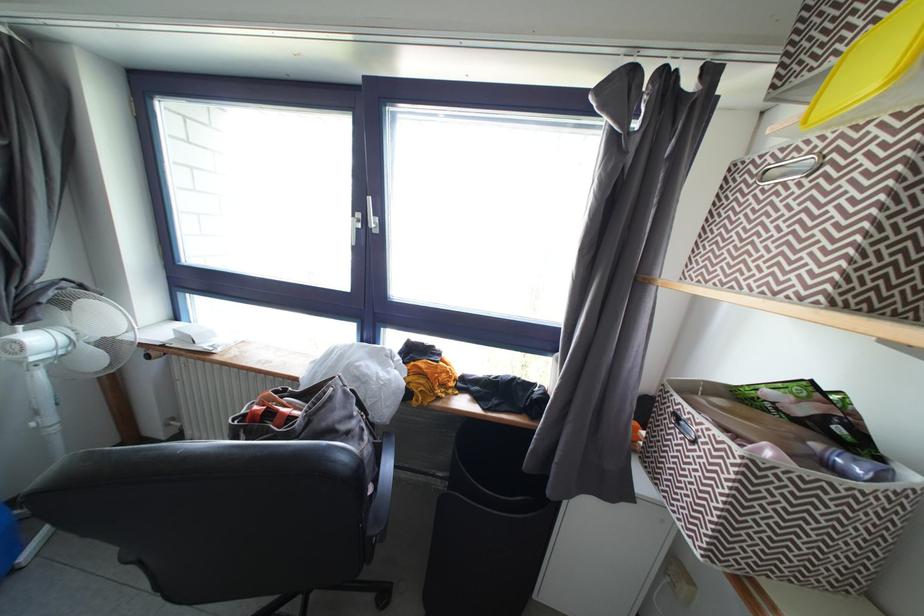
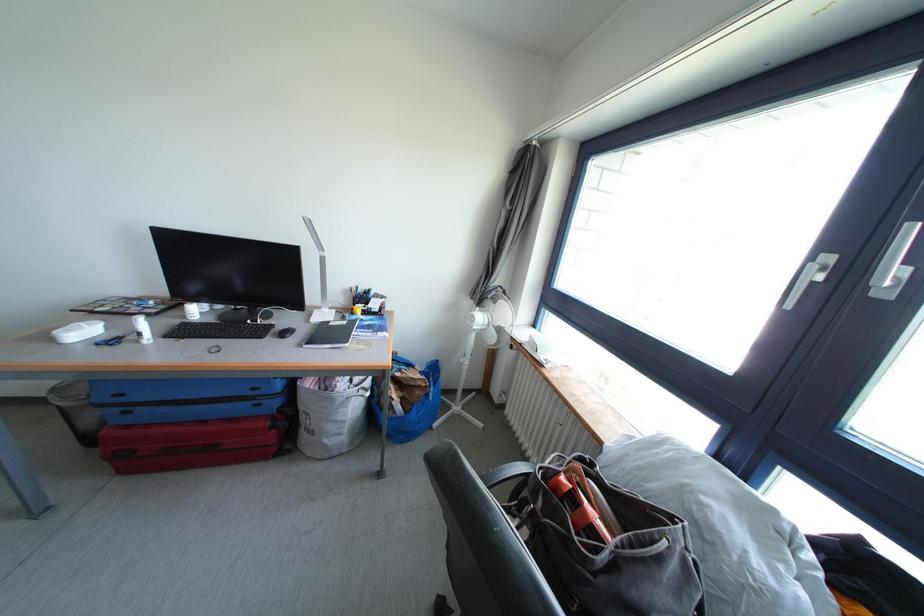
Find the pixel in the second image that matches point (288, 418) in the first image.

(591, 517)